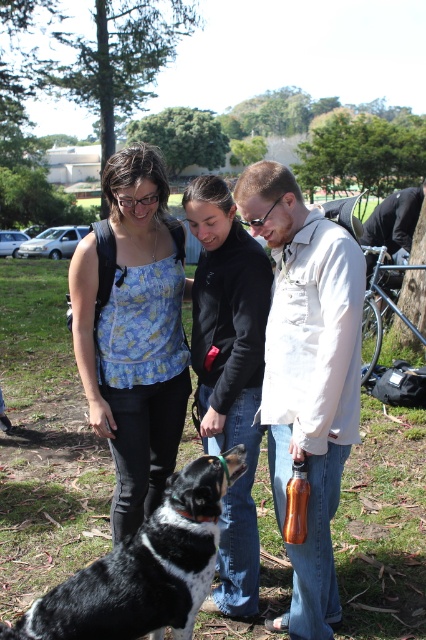
Does matte floral tank top at center appear under bronze metallic bottle at lower center?

Incorrect, matte floral tank top at center is not positioned below bronze metallic bottle at lower center.

Does matte floral tank top at center appear on the left side of bronze metallic bottle at lower center?

Yes, matte floral tank top at center is to the left of bronze metallic bottle at lower center.

Locate an element on the screen. The width and height of the screenshot is (426, 640). matte floral tank top at center is located at coordinates (132, 332).

Does matte white shirt at center have a larger size compared to bronze metallic bottle at lower center?

Yes, matte white shirt at center is bigger than bronze metallic bottle at lower center.

Can you confirm if matte white shirt at center is taller than bronze metallic bottle at lower center?

Yes.

This screenshot has width=426, height=640. What are the coordinates of `matte white shirt at center` in the screenshot? It's located at (307, 372).

Identify the location of matte white shirt at center. (307, 372).

Which is more to the left, matte white shirt at center or black matte jacket at center?

black matte jacket at center is more to the left.

Who is higher up, matte white shirt at center or black matte jacket at center?

matte white shirt at center is above.

The height and width of the screenshot is (640, 426). What do you see at coordinates (307, 372) in the screenshot?
I see `matte white shirt at center` at bounding box center [307, 372].

Image resolution: width=426 pixels, height=640 pixels. I want to click on matte white shirt at center, so click(x=307, y=372).